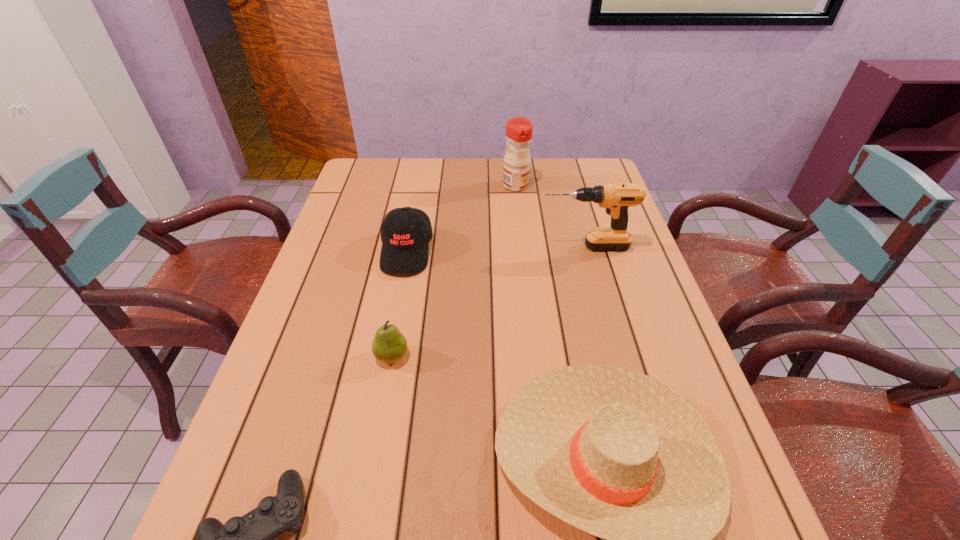
Image resolution: width=960 pixels, height=540 pixels. What are the coordinates of `object located in the far edge section of the desktop` in the screenshot? It's located at (516, 169).

Where is `object that is at the right edge`? object that is at the right edge is located at coordinates (616, 198).

You are a GUI agent. You are given a task and a screenshot of the screen. Output one action in this format:
    pyautogui.click(x=<x>, y=<y>)
    Task: Click on the vacant area at the far edge of the desktop
    This screenshot has width=960, height=540.
    Given the screenshot: What is the action you would take?
    pyautogui.click(x=530, y=180)

In order to click on free space at the near edge of the desktop in this screenshot , I will do tap(311, 523).

This screenshot has height=540, width=960. What are the coordinates of `vacant space at the left edge of the desktop` in the screenshot? It's located at (252, 456).

Image resolution: width=960 pixels, height=540 pixels. I want to click on free spot at the right edge of the desktop, so click(675, 345).

In the image, there is a desktop. At what (x,y) coordinates should I click in order to perform the action: click on free space at the far right corner. Please return your answer as a coordinate pair (x, y). This screenshot has height=540, width=960. Looking at the image, I should click on (561, 168).

In order to click on free space between the pear and the baseball cap in this screenshot , I will do `click(399, 303)`.

The image size is (960, 540). What are the coordinates of `free space between the farthest object and the pear` in the screenshot? It's located at [454, 271].

You are a GUI agent. You are given a task and a screenshot of the screen. Output one action in this format:
    pyautogui.click(x=<x>, y=<y>)
    Task: Click on the free area in between the condiment and the baseball cap
    The image size is (960, 540).
    Given the screenshot: What is the action you would take?
    pyautogui.click(x=461, y=219)